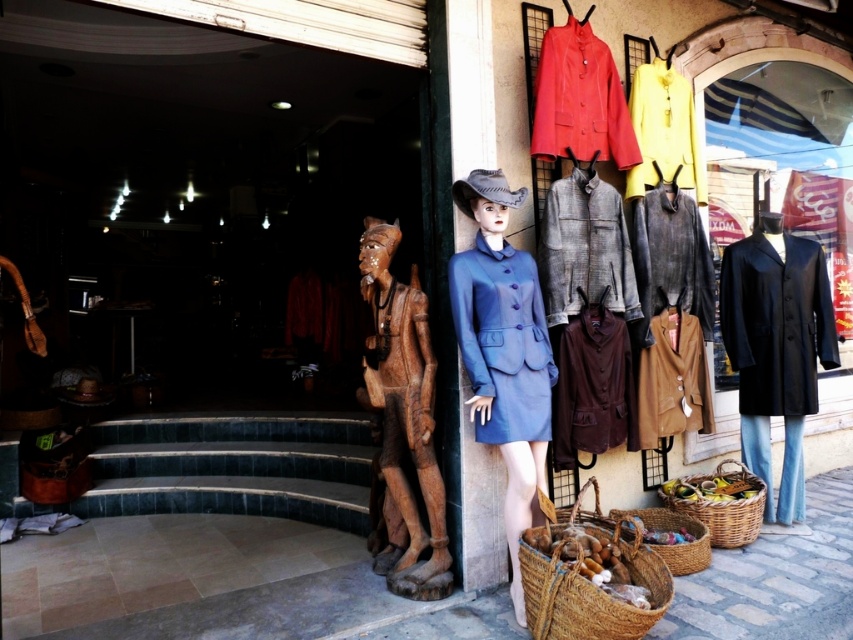
Between black leather coat at right and brown woven basket at lower center, which one has less height?

brown woven basket at lower center

Is black leather coat at right positioned at the back of brown woven basket at lower center?

Yes, black leather coat at right is further from the viewer.

Which is in front, point (724, 348) or point (550, 525)?

Point (550, 525) is more forward.

Find the location of `black leather coat at right`. black leather coat at right is located at coordinates (776, 323).

Between brown woven basket at lower center and woven brown basket at lower center, which one is positioned higher?

brown woven basket at lower center is above.

Is brown woven basket at lower center positioned at the back of woven brown basket at lower center?

No, brown woven basket at lower center is closer to the viewer.

Does point (671, 579) come closer to viewer compared to point (689, 557)?

Yes.

Find the location of a particular element. brown woven basket at lower center is located at coordinates (590, 593).

Describe the element at coordinates (579, 99) in the screenshot. I see `matte red coat at upper center` at that location.

Between matte red coat at upper center and yellow wool coat at upper right, which one has less height?

Standing shorter between the two is matte red coat at upper center.

Is point (592, 128) positioned before point (635, 81)?

Yes, it is in front of point (635, 81).

I want to click on matte red coat at upper center, so click(579, 99).